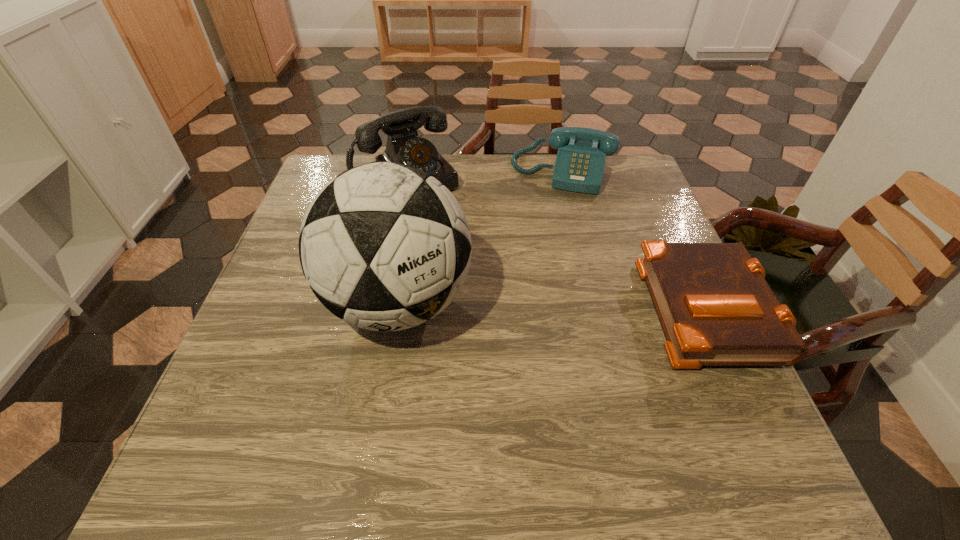
The width and height of the screenshot is (960, 540). Identify the location of soccer ball. (386, 247).

Image resolution: width=960 pixels, height=540 pixels. I want to click on the shortest object, so click(714, 305).

Locate an element on the screen. the third tallest object is located at coordinates (580, 161).

This screenshot has width=960, height=540. Identify the location of the shorter telephone. (x=580, y=161).

Identify the location of the third shortest object. This screenshot has width=960, height=540. (404, 146).

Find the location of a particular element. This screenshot has height=540, width=960. the taller telephone is located at coordinates (404, 146).

This screenshot has width=960, height=540. In order to click on blank area located on the surface of the tallest object where the brand logo is visible in this screenshot , I will do `click(380, 415)`.

Locate an element on the screen. The width and height of the screenshot is (960, 540). free space located 0.400m on the dial of the right telephone is located at coordinates click(530, 301).

Where is `free space located on the dial of the right telephone`? free space located on the dial of the right telephone is located at coordinates (540, 255).

Locate an element on the screen. Image resolution: width=960 pixels, height=540 pixels. free space located 0.120m on the dial of the right telephone is located at coordinates (548, 221).